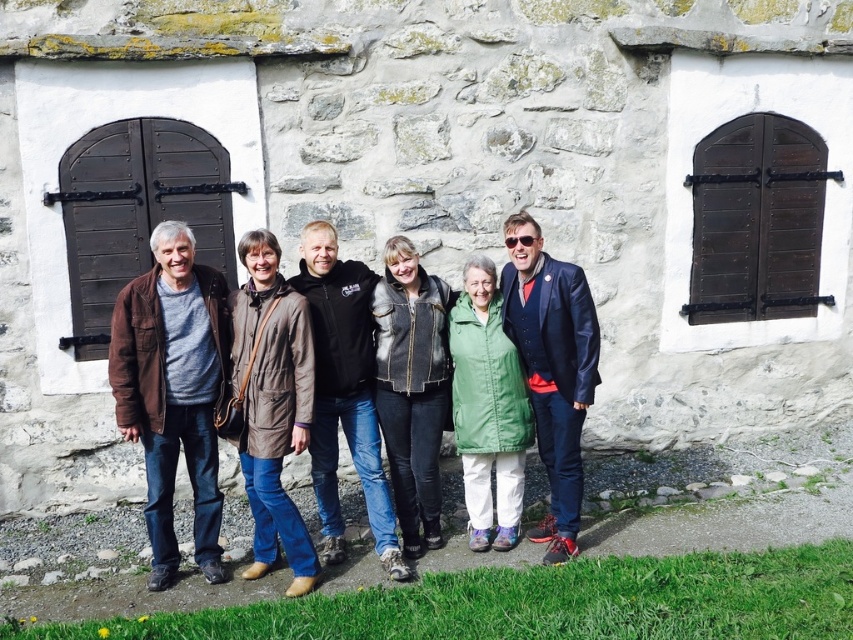
Is point (202, 368) farther from viewer compared to point (175, 452)?

No, it is not.

The height and width of the screenshot is (640, 853). Describe the element at coordinates (218, 396) in the screenshot. I see `brown leather jacket at center` at that location.

In order to click on brown leather jacket at center in this screenshot , I will do `click(218, 396)`.

Find the location of a particular element. brown leather jacket at center is located at coordinates (218, 396).